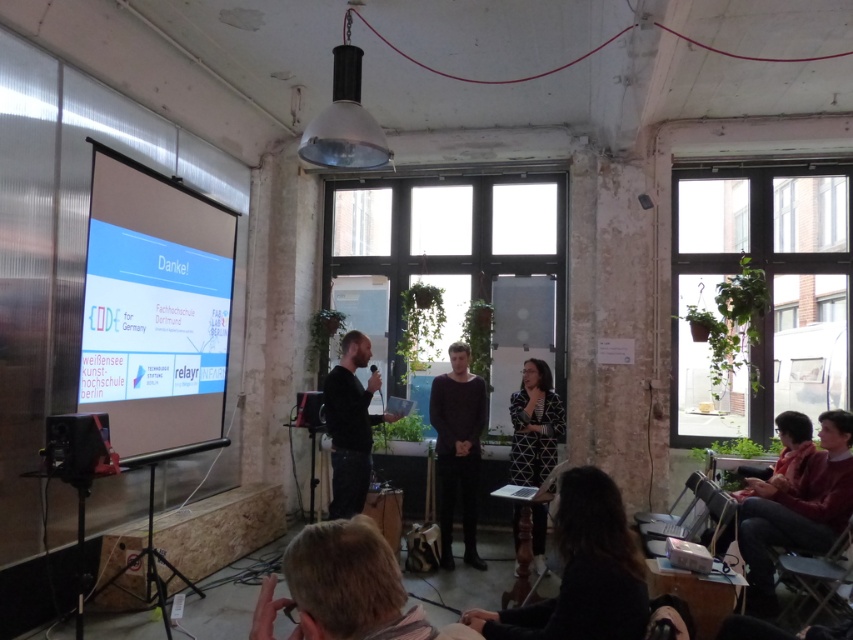
Does blonde hair at lower center have a lesser width compared to black matte shirt at center?

No.

Can you confirm if blonde hair at lower center is taller than black matte shirt at center?

Incorrect, blonde hair at lower center's height is not larger of black matte shirt at center's.

The image size is (853, 640). Identify the location of blonde hair at lower center. (345, 588).

Can you confirm if matte white projection screen at left is positioned to the left of black printed dress at center?

Indeed, matte white projection screen at left is positioned on the left side of black printed dress at center.

You are a GUI agent. You are given a task and a screenshot of the screen. Output one action in this format:
    pyautogui.click(x=<x>, y=<y>)
    Task: Click on the matte white projection screen at left
    Image resolution: width=853 pixels, height=640 pixels.
    Given the screenshot: What is the action you would take?
    pyautogui.click(x=155, y=307)

Image resolution: width=853 pixels, height=640 pixels. Identify the location of matte white projection screen at left. (155, 307).

Which of these two, blonde hair at lower center or dark red sweater at lower right, stands shorter?

With less height is blonde hair at lower center.

Is point (355, 618) behind point (770, 492)?

That is False.

Measure the distance between blonde hair at lower center and camera.

blonde hair at lower center and camera are 1.20 meters apart from each other.

The height and width of the screenshot is (640, 853). Find the location of `blonde hair at lower center`. blonde hair at lower center is located at coordinates [345, 588].